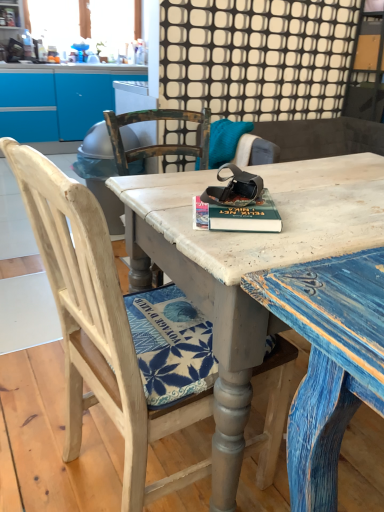
Question: Would you say hardcover book at center is a long distance from wooden chair at center?

Choices:
 (A) yes
 (B) no

Answer: (B)

Question: Does hardcover book at center have a lesser height compared to wooden chair at center?

Choices:
 (A) no
 (B) yes

Answer: (B)

Question: Is hardcover book at center thinner than wooden chair at center?

Choices:
 (A) yes
 (B) no

Answer: (A)

Question: Is hardcover book at center to the left of wooden chair at center from the viewer's perspective?

Choices:
 (A) no
 (B) yes

Answer: (A)

Question: From a real-world perspective, is hardcover book at center beneath wooden chair at center?

Choices:
 (A) no
 (B) yes

Answer: (A)

Question: Does hardcover book at center come in front of wooden chair at center?

Choices:
 (A) yes
 (B) no

Answer: (B)

Question: Is distressed wood desk at center in front of hardcover book at center?

Choices:
 (A) no
 (B) yes

Answer: (B)

Question: From the image's perspective, is distressed wood desk at center located above hardcover book at center?

Choices:
 (A) yes
 (B) no

Answer: (B)

Question: Does distressed wood desk at center have a greater height compared to hardcover book at center?

Choices:
 (A) yes
 (B) no

Answer: (A)

Question: Is distressed wood desk at center completely or partially outside of hardcover book at center?

Choices:
 (A) yes
 (B) no

Answer: (A)

Question: From the image's perspective, is distressed wood desk at center located beneath hardcover book at center?

Choices:
 (A) no
 (B) yes

Answer: (B)

Question: Would you say distressed wood desk at center is a long distance from hardcover book at center?

Choices:
 (A) yes
 (B) no

Answer: (B)

Question: From a real-world perspective, is distressed wood desk at center below wooden chair at center?

Choices:
 (A) no
 (B) yes

Answer: (B)